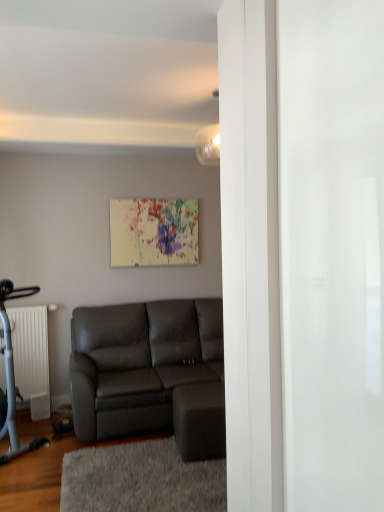
Question: Considering the positions of white matte radiator at left and matte white light fixture at upper center in the image, is white matte radiator at left wider or thinner than matte white light fixture at upper center?

Choices:
 (A) wide
 (B) thin

Answer: (A)

Question: Based on their sizes in the image, would you say white matte radiator at left is bigger or smaller than matte white light fixture at upper center?

Choices:
 (A) small
 (B) big

Answer: (B)

Question: Estimate the real-world distances between objects in this image. Which object is farther from the matte white light fixture at upper center?

Choices:
 (A) gray textured rug at lower center
 (B) matte gray couch at center
 (C) white matte radiator at left

Answer: (C)

Question: Which is farther from the gray textured rug at lower center?

Choices:
 (A) matte white light fixture at upper center
 (B) matte gray couch at center
 (C) white matte radiator at left

Answer: (A)